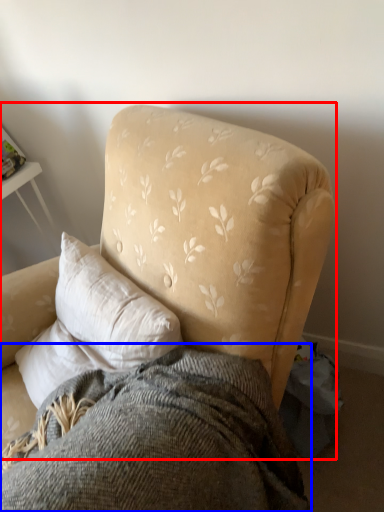
Question: Which point is further to the camera, chair (highlighted by a red box) or bedding (highlighted by a blue box)?

Choices:
 (A) chair
 (B) bedding

Answer: (B)